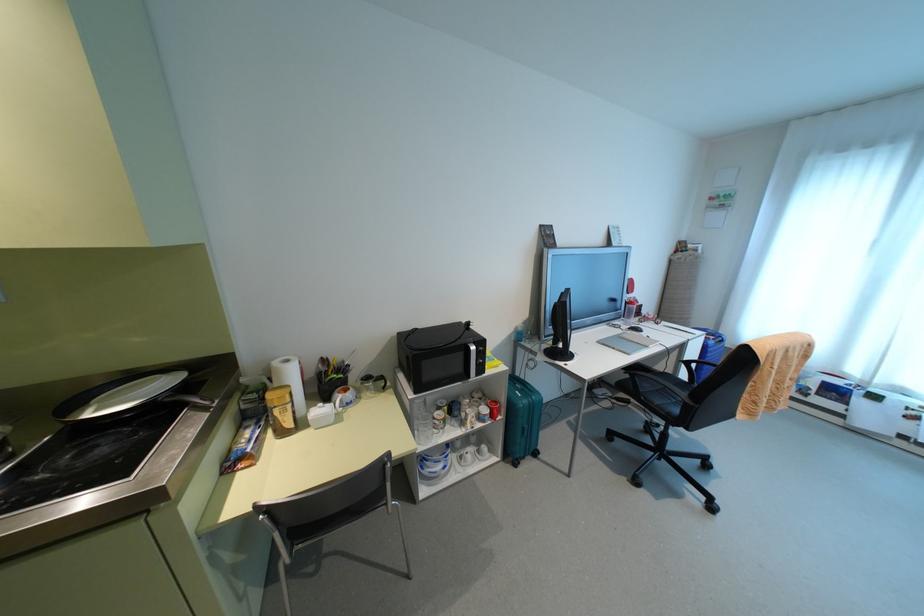
Where would you lift the white and blue bowl? Please return your answer as a coordinate pair (x, y).

(433, 464)